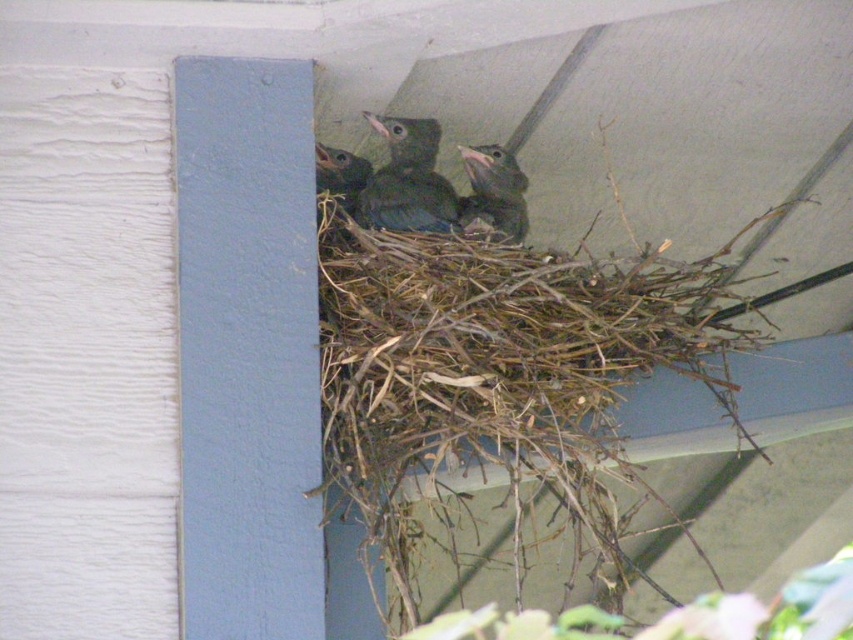
Question: Estimate the real-world distances between objects in this image. Which object is farther from the green feathered bird at upper center?

Choices:
 (A) green matte bird at center
 (B) dark green feathers at upper center

Answer: (B)

Question: Can you confirm if green matte bird at center is wider than dark green feathers at upper center?

Choices:
 (A) yes
 (B) no

Answer: (A)

Question: Estimate the real-world distances between objects in this image. Which object is farther from the green feathered bird at upper center?

Choices:
 (A) green matte bird at center
 (B) dark green feathers at upper center

Answer: (B)

Question: Which of the following is the farthest from the observer?

Choices:
 (A) (505, 156)
 (B) (426, 196)

Answer: (A)

Question: Does green matte bird at center have a greater width compared to dark green feathers at upper center?

Choices:
 (A) no
 (B) yes

Answer: (B)

Question: Does green matte bird at center appear on the left side of green feathered bird at upper center?

Choices:
 (A) no
 (B) yes

Answer: (B)